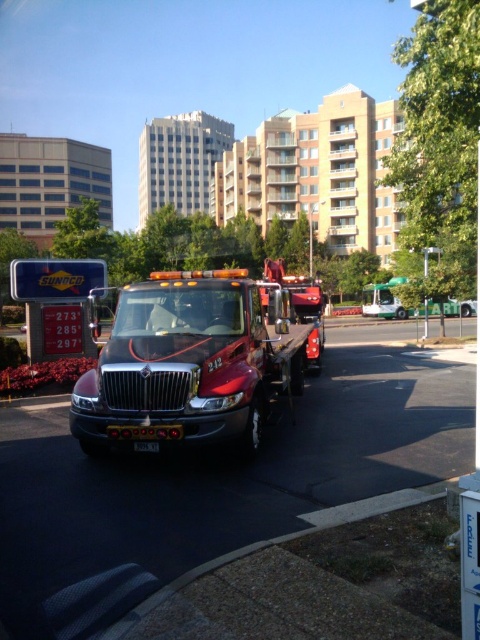
Can you confirm if shiny red tow truck at center is wider than black plastic license plate at center?

Yes, shiny red tow truck at center is wider than black plastic license plate at center.

Measure the distance between shiny red tow truck at center and camera.

shiny red tow truck at center is 6.08 meters away from camera.

Does point (247, 284) come farther from viewer compared to point (135, 444)?

That is True.

Find the location of a particular element. This screenshot has width=480, height=640. shiny red tow truck at center is located at coordinates [x=190, y=364].